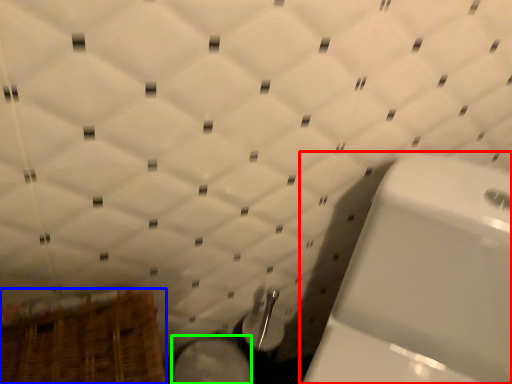
Question: Which object is positioned farthest from toilet (highlighted by a red box)? Select from basket (highlighted by a blue box) and bidet (highlighted by a green box).

Choices:
 (A) basket
 (B) bidet

Answer: (A)